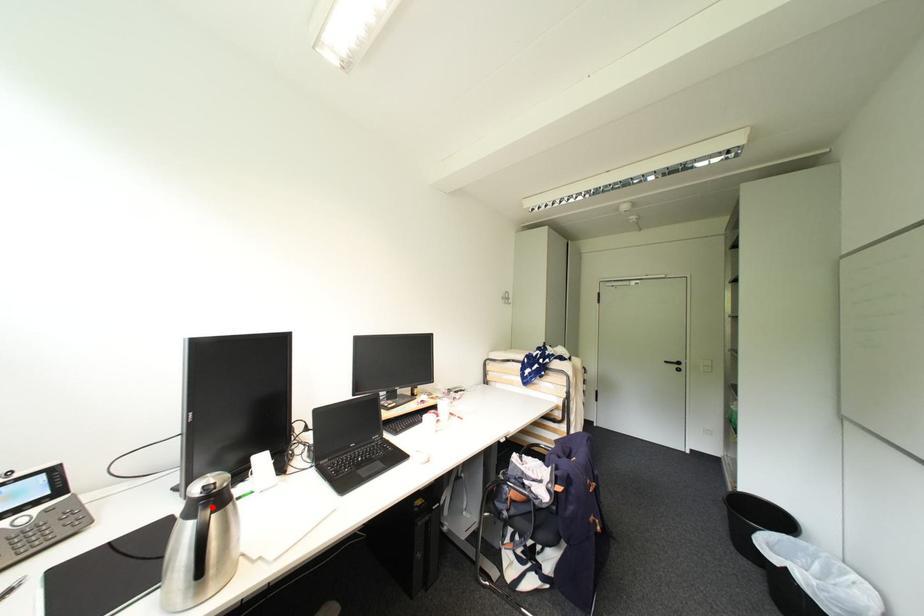
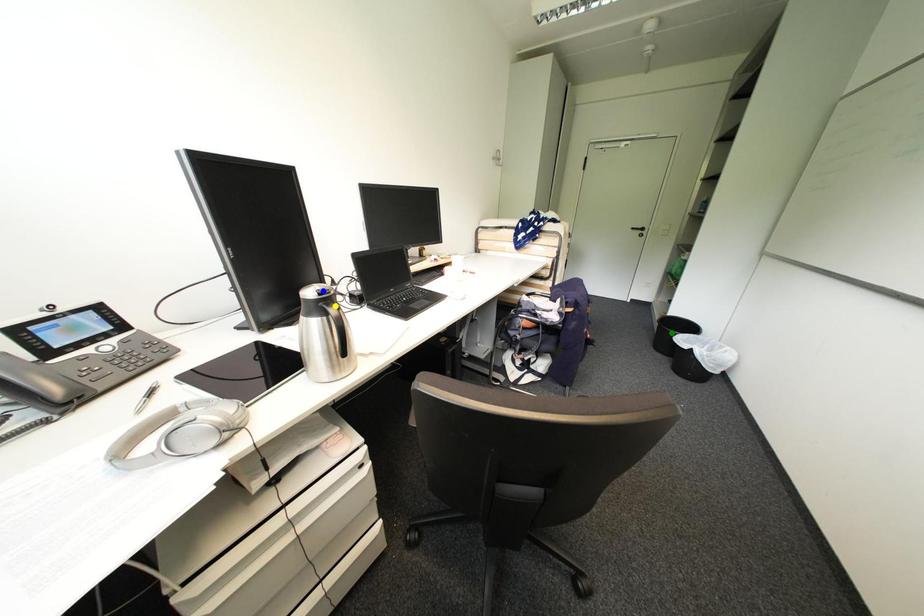
Question: I am providing you with two images of the same scene from different viewpoints. A red point is marked on the first image. You are given multiple points on the second image. Which spot in image 2 lines up with the point in image 1?

Choices:
 (A) blue point
 (B) yellow point
 (C) green point

Answer: (B)